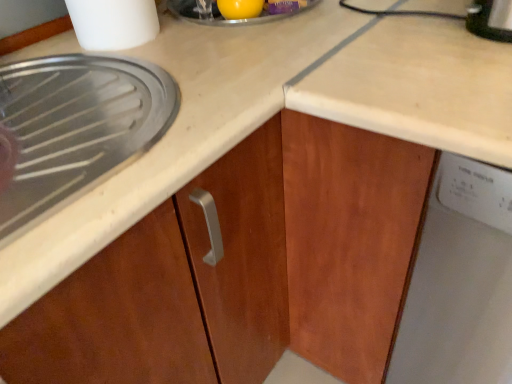
Question: Is yellow rubber ball at upper center outside of white plastic container at upper left?

Choices:
 (A) no
 (B) yes

Answer: (B)

Question: Is yellow rubber ball at upper center aimed at white plastic container at upper left?

Choices:
 (A) yes
 (B) no

Answer: (B)

Question: From a real-world perspective, is yellow rubber ball at upper center physically below white plastic container at upper left?

Choices:
 (A) no
 (B) yes

Answer: (B)

Question: Does yellow rubber ball at upper center have a lesser height compared to white plastic container at upper left?

Choices:
 (A) yes
 (B) no

Answer: (A)

Question: Can you confirm if yellow rubber ball at upper center is taller than white plastic container at upper left?

Choices:
 (A) no
 (B) yes

Answer: (A)

Question: Would you say yellow rubber ball at upper center is to the left or to the right of white plastic container at upper left in the picture?

Choices:
 (A) left
 (B) right

Answer: (B)

Question: In the image, is yellow rubber ball at upper center positioned in front of or behind white plastic container at upper left?

Choices:
 (A) behind
 (B) front

Answer: (A)

Question: Considering the positions of yellow rubber ball at upper center and white plastic container at upper left in the image, is yellow rubber ball at upper center wider or thinner than white plastic container at upper left?

Choices:
 (A) wide
 (B) thin

Answer: (A)

Question: Looking at the image, does yellow rubber ball at upper center seem bigger or smaller compared to white plastic container at upper left?

Choices:
 (A) big
 (B) small

Answer: (B)

Question: In terms of height, does white plastic dishwasher at right look taller or shorter compared to white plastic container at upper left?

Choices:
 (A) short
 (B) tall

Answer: (B)

Question: Does point (473, 337) appear closer or farther from the camera than point (115, 44)?

Choices:
 (A) farther
 (B) closer

Answer: (B)

Question: From the image's perspective, is white plastic dishwasher at right above or below white plastic container at upper left?

Choices:
 (A) below
 (B) above

Answer: (A)

Question: Relative to white plastic container at upper left, is white plastic dishwasher at right in front or behind?

Choices:
 (A) front
 (B) behind

Answer: (A)

Question: Based on their sizes in the image, would you say white plastic dishwasher at right is bigger or smaller than yellow rubber ball at upper center?

Choices:
 (A) small
 (B) big

Answer: (B)

Question: From the image's perspective, is white plastic dishwasher at right located above or below yellow rubber ball at upper center?

Choices:
 (A) below
 (B) above

Answer: (A)